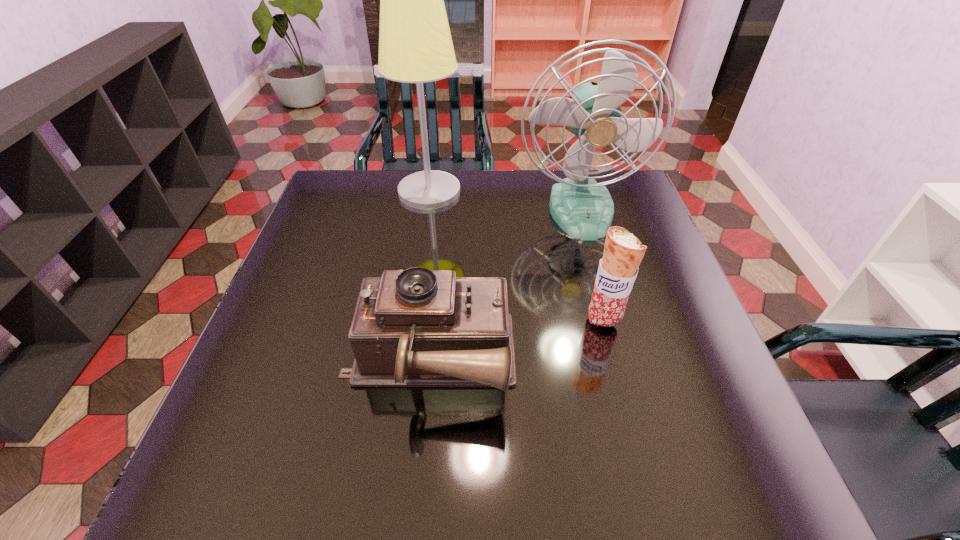
You are a GUI agent. You are given a task and a screenshot of the screen. Output one action in this format:
    pyautogui.click(x=<x>, y=<y>)
    Task: Click on the free spot between the shortest object and the third tallest object
    The height and width of the screenshot is (540, 960).
    Given the screenshot: What is the action you would take?
    pyautogui.click(x=516, y=341)

Locate an element on the screen. vacant space that's between the third tallest object and the table lamp is located at coordinates (516, 255).

At what (x,y) coordinates should I click in order to perform the action: click on vacant area that lies between the third tallest object and the second tallest object. Please return your answer as a coordinate pair (x, y). Image resolution: width=960 pixels, height=540 pixels. Looking at the image, I should click on (592, 265).

Identify which object is the closest to the fan. Please provide its 2D coordinates. Your answer should be formatted as a tuple, i.e. [(x, y)], where the tuple contains the x and y coordinates of a point satisfying the conditions above.

[(415, 46)]

In order to click on the closest object to the third shortest object in this screenshot , I will do (415, 46).

At what (x,y) coordinates should I click in order to perform the action: click on vacant space that satisfies the following two spatial constraints: 1. in front of the second tallest object, directing airflow; 2. on the horn of the phonograph_record. Please return your answer as a coordinate pair (x, y). Looking at the image, I should click on (623, 362).

Find the location of a particular element. free location that satisfies the following two spatial constraints: 1. in front of the fan, directing airflow; 2. on the horn of the phonograph_record is located at coordinates (623, 362).